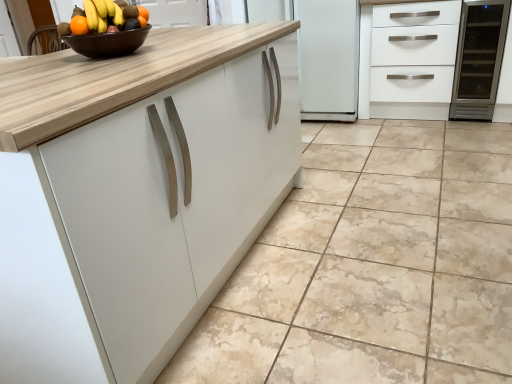
Question: From a real-world perspective, is white matte cabinet at upper right positioned under beige marble floor at center based on gravity?

Choices:
 (A) yes
 (B) no

Answer: (B)

Question: Does white matte cabinet at upper right have a greater height compared to beige marble floor at center?

Choices:
 (A) yes
 (B) no

Answer: (A)

Question: From a real-world perspective, is white matte cabinet at upper right located higher than beige marble floor at center?

Choices:
 (A) yes
 (B) no

Answer: (A)

Question: Does white matte cabinet at upper right have a greater width compared to beige marble floor at center?

Choices:
 (A) yes
 (B) no

Answer: (B)

Question: Can you confirm if white matte cabinet at upper right is smaller than beige marble floor at center?

Choices:
 (A) no
 (B) yes

Answer: (B)

Question: Is white matte cabinet at upper right far from beige marble floor at center?

Choices:
 (A) yes
 (B) no

Answer: (A)

Question: Is beige marble floor at center further to the viewer compared to orange matte grapefruit at upper left?

Choices:
 (A) no
 (B) yes

Answer: (A)

Question: From a real-world perspective, is beige marble floor at center positioned over orange matte grapefruit at upper left based on gravity?

Choices:
 (A) no
 (B) yes

Answer: (A)

Question: Can you see beige marble floor at center touching orange matte grapefruit at upper left?

Choices:
 (A) yes
 (B) no

Answer: (B)

Question: Is beige marble floor at center shorter than orange matte grapefruit at upper left?

Choices:
 (A) yes
 (B) no

Answer: (A)

Question: Is beige marble floor at center aimed at orange matte grapefruit at upper left?

Choices:
 (A) yes
 (B) no

Answer: (B)

Question: Is beige marble floor at center at the left side of orange matte grapefruit at upper left?

Choices:
 (A) no
 (B) yes

Answer: (A)

Question: From a real-world perspective, is brown glossy bowl at upper center physically above orange matte grapefruit at upper left?

Choices:
 (A) no
 (B) yes

Answer: (A)